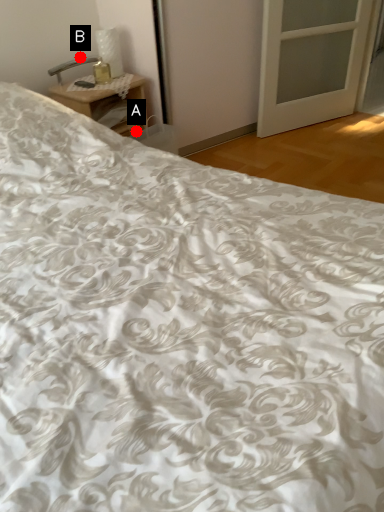
Question: Two points are circled on the image, labeled by A and B beside each circle. Which point is closer to the camera taking this photo?

Choices:
 (A) A is closer
 (B) B is closer

Answer: (A)